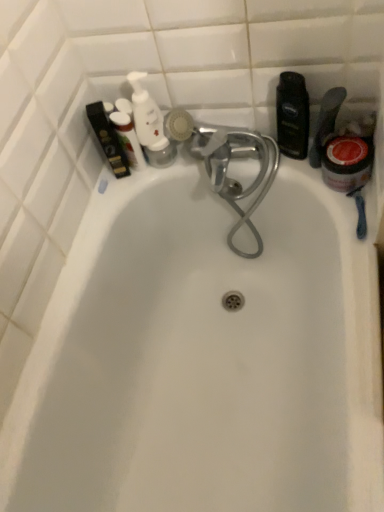
Question: Would you say matte black box at upper left, which is the fifth toiletry in right-to-left order, is to the left or to the right of red glossy jar at right in the picture?

Choices:
 (A) left
 (B) right

Answer: (A)

Question: In the image, is matte black box at upper left, which is the fifth toiletry in right-to-left order, positioned in front of or behind red glossy jar at right?

Choices:
 (A) front
 (B) behind

Answer: (B)

Question: Based on their relative distances, which object is nearer to the red glossy jar at right?

Choices:
 (A) translucent plastic bottle at right, which is counted as the first toiletry, starting from the right
 (B) black matte bottle at upper right, the fourth toiletry positioned from the left
 (C) matte black box at upper left, which is the fifth toiletry in right-to-left order
 (D) white plastic pump bottle at upper left, arranged as the third toiletry when viewed from the left
 (E) white glossy pump bottle at upper left, the 4th toiletry positioned from the right

Answer: (A)

Question: Estimate the real-world distances between objects in this image. Which object is farther from the white plastic pump bottle at upper left, positioned as the 3th toiletry in right-to-left order?

Choices:
 (A) white glossy pump bottle at upper left, the 4th toiletry positioned from the right
 (B) black matte bottle at upper right, the fourth toiletry positioned from the left
 (C) matte black box at upper left, positioned as the 1th toiletry in left-to-right order
 (D) translucent plastic bottle at right, which is counted as the first toiletry, starting from the right
 (E) red glossy jar at right

Answer: (E)